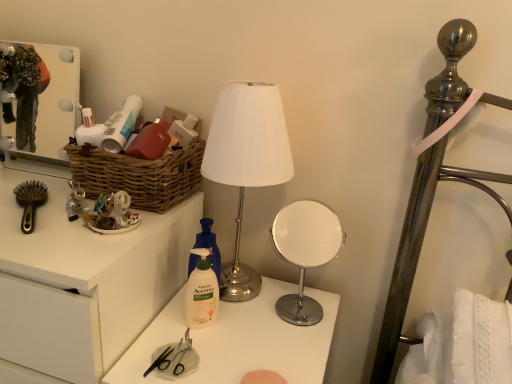
Describe the element at coordinates (182, 353) in the screenshot. I see `metallic silver scissors at center` at that location.

Image resolution: width=512 pixels, height=384 pixels. What do you see at coordinates (246, 162) in the screenshot?
I see `white matte lamp at center` at bounding box center [246, 162].

The width and height of the screenshot is (512, 384). In order to click on white matte lotion at center, placed as the first toiletry when sorted from bottom to top in this screenshot , I will do `click(201, 292)`.

Describe the element at coordinates (305, 252) in the screenshot. I see `white glossy mirror at center right` at that location.

Find the location of a particular element. This screenshot has width=512, height=384. matte plastic scissors at center is located at coordinates (237, 341).

Considering the positions of objects matte white tube at upper left, the second toiletry when ordered from bottom to top, and brown woven basket at left in the image provided, who is more to the left, matte white tube at upper left, the second toiletry when ordered from bottom to top, or brown woven basket at left?

matte white tube at upper left, the second toiletry when ordered from bottom to top.

Which of these two, matte white tube at upper left, the second toiletry when ordered from bottom to top, or brown woven basket at left, stands shorter?

matte white tube at upper left, the second toiletry when ordered from bottom to top, is shorter.

Is matte white tube at upper left, which is counted as the first toiletry, starting from the top, smaller than brown woven basket at left?

Yes.

How much distance is there between matte white tube at upper left, acting as the 1th toiletry starting from the left, and brown woven basket at left?

matte white tube at upper left, acting as the 1th toiletry starting from the left, is 4.35 inches from brown woven basket at left.

Is metallic silver scissors at center looking in the opposite direction of white matte lamp at center?

Yes, metallic silver scissors at center is facing away from white matte lamp at center.

Between metallic silver scissors at center and white matte lamp at center, which one is positioned in front?

white matte lamp at center is more forward.

Is metallic silver scissors at center placed right next to white matte lamp at center?

No, metallic silver scissors at center is not touching white matte lamp at center.

From the image's perspective, is metallic silver scissors at center positioned above or below white matte lamp at center?

metallic silver scissors at center is below white matte lamp at center.

Between white glossy drawer at left and metallic silver scissors at center, which one appears on the right side from the viewer's perspective?

metallic silver scissors at center is more to the right.

Which of these two, white glossy drawer at left or metallic silver scissors at center, is wider?

With larger width is white glossy drawer at left.

Measure the distance from white glossy drawer at left to metallic silver scissors at center.

white glossy drawer at left and metallic silver scissors at center are 10.07 inches apart.

Could you tell me if brown plastic brush at left is facing white glossy mirror at center right?

No.

From the image's perspective, relative to white glossy mirror at center right, is brown plastic brush at left above or below?

brown plastic brush at left is above white glossy mirror at center right.

Is the position of brown plastic brush at left more distant than that of white glossy mirror at center right?

No, brown plastic brush at left is in front of white glossy mirror at center right.

Is white glossy mirror at center right inside brown plastic brush at left?

No, brown plastic brush at left does not contain white glossy mirror at center right.

From a real-world perspective, which is physically below, white matte lamp at center or white glossy drawer at left?

white glossy drawer at left.

In the scene shown: Does white matte lamp at center have a lesser width compared to white glossy drawer at left?

Indeed, white matte lamp at center has a lesser width compared to white glossy drawer at left.

Can you tell me how much white matte lamp at center and white glossy drawer at left differ in facing direction?

The facing directions of white matte lamp at center and white glossy drawer at left are 0.882 degrees apart.

Where is `lamp on the right of the white glossy drawer at left`? The height and width of the screenshot is (384, 512). lamp on the right of the white glossy drawer at left is located at coordinates (246, 162).

Does point (30, 212) come farther from viewer compared to point (207, 320)?

No, (30, 212) is closer to viewer.

From the image's perspective, is brown plastic brush at left positioned above or below white matte lotion at center, placed as the first toiletry when sorted from bottom to top?

brown plastic brush at left is above white matte lotion at center, placed as the first toiletry when sorted from bottom to top.

Looking at this image, what's the angular difference between brown plastic brush at left and white matte lotion at center, positioned as the second toiletry in left-to-right order,'s facing directions?

4.18 degrees.

Locate an element on the screen. Image resolution: width=512 pixels, height=384 pixels. brush above the white matte lotion at center, marked as the first toiletry in a right-to-left arrangement (from the image's perspective) is located at coordinates (30, 201).

From the image's perspective, is matte plastic scissors at center positioned above or below white glossy mirror at center right?

From the image's perspective, matte plastic scissors at center appears below white glossy mirror at center right.

Are matte plastic scissors at center and white glossy mirror at center right making contact?

matte plastic scissors at center and white glossy mirror at center right are clearly separated.

Is matte plastic scissors at center facing away from white glossy mirror at center right?

No, matte plastic scissors at center's orientation is not away from white glossy mirror at center right.

Is the depth of matte plastic scissors at center less than that of white glossy mirror at center right?

Yes, matte plastic scissors at center is in front of white glossy mirror at center right.

Locate an element on the screen. The width and height of the screenshot is (512, 384). basket below the matte white tube at upper left, which appears as the 2th toiletry when viewed from the right (from a real-world perspective) is located at coordinates (138, 175).

Find the location of a particular element. The image size is (512, 384). lamp above the metallic silver scissors at center (from a real-world perspective) is located at coordinates (246, 162).

Looking at the image, which one is located closer to white glossy drawer at left, brown plastic brush at left or brown woven basket at left?

The object closer to white glossy drawer at left is brown woven basket at left.

Estimate the real-world distances between objects in this image. Which object is closer to white glossy medicine cabinet at upper left, brown plastic brush at left or matte plastic scissors at center?

brown plastic brush at left is closer to white glossy medicine cabinet at upper left.

From the picture: Which object lies nearer to the anchor point white matte lamp at center, white glossy medicine cabinet at upper left or matte white tube at upper left, the second toiletry when ordered from bottom to top?

matte white tube at upper left, the second toiletry when ordered from bottom to top, is closer to white matte lamp at center.

Which object lies further to the anchor point white matte lamp at center, brown plastic brush at left or white glossy medicine cabinet at upper left?

The object further to white matte lamp at center is white glossy medicine cabinet at upper left.

Estimate the real-world distances between objects in this image. Which object is further from white glossy mirror at center right, white matte lotion at center, positioned as the second toiletry in left-to-right order, or white glossy medicine cabinet at upper left?

white matte lotion at center, positioned as the second toiletry in left-to-right order, is further to white glossy mirror at center right.

Estimate the real-world distances between objects in this image. Which object is further from white matte lotion at center, which ranks as the 2th toiletry in top-to-bottom order, brown woven basket at left or matte white tube at upper left, acting as the 1th toiletry starting from the left?

matte white tube at upper left, acting as the 1th toiletry starting from the left.

When comparing their distances from white glossy mirror at center right, does matte plastic scissors at center or white glossy medicine cabinet at upper left seem closer?

white glossy medicine cabinet at upper left is closer to white glossy mirror at center right.

From the image, which object appears to be nearer to white matte lotion at center, positioned as the second toiletry in left-to-right order, brown woven basket at left or white glossy drawer at left?

white glossy drawer at left.

Identify the location of furniture that lies between white glossy medicine cabinet at upper left and matte plastic scissors at center from top to bottom. (84, 282).

The width and height of the screenshot is (512, 384). I want to click on brush that lies between matte white tube at upper left, which is counted as the first toiletry, starting from the top, and white matte lotion at center, positioned as the second toiletry in left-to-right order, from top to bottom, so click(30, 201).

Locate an element on the screen. scissors that lies between white glossy medicine cabinet at upper left and white glossy drawer at left from top to bottom is located at coordinates (182, 353).

You are a GUI agent. You are given a task and a screenshot of the screen. Output one action in this format:
    pyautogui.click(x=<x>, y=<y>)
    Task: Click on the medicine cabinet situated between white glossy drawer at left and white glossy mirror at center right from left to right
    This screenshot has width=512, height=384.
    Given the screenshot: What is the action you would take?
    pyautogui.click(x=57, y=100)